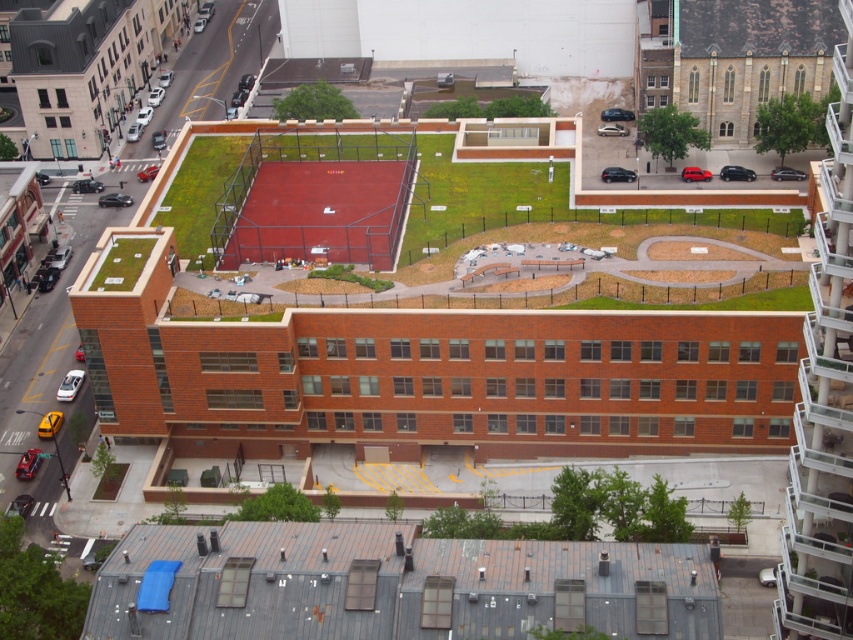
Who is taller, gray metal roof at lower center or green grass at center?

Standing taller between the two is green grass at center.

Does gray metal roof at lower center have a lesser width compared to green grass at center?

Yes, gray metal roof at lower center is thinner than green grass at center.

Where is `gray metal roof at lower center`? This screenshot has width=853, height=640. gray metal roof at lower center is located at coordinates (392, 586).

Where is `gray metal roof at lower center`? gray metal roof at lower center is located at coordinates (392, 586).